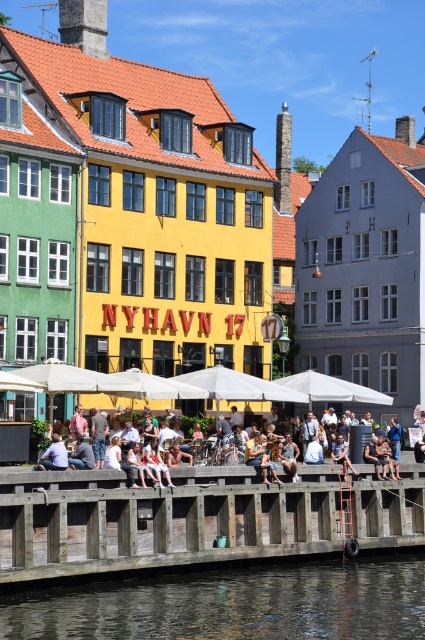
You are standing at the point labeled as point (345,468) and want to walk to the point labeled as point (19,621). Based on the scene description, which direction should you move relative to your current position?

You should move forward because point (19,621) is in front of point (345,468).

You are a tourist standing at the dock in front of the yellow building at Nyhavn 17. You notice the transparent water at lower center and the light blue denim jeans at center. Which object is closer to you?

The transparent water at lower center is closer to you because it is in front of the light blue denim jeans at center.

You are standing on the wooden dock at center. Can you see the transparent water at lower center below you?

Yes, because the wooden dock at center is above the transparent water at lower center, so you can see the water below.